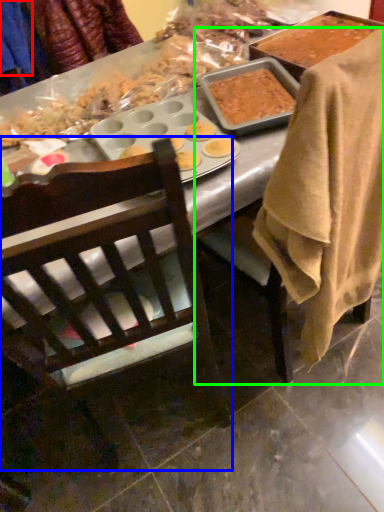
Question: Based on their relative distances, which object is nearer to clothing (highlighted by a red box)? Choose from chair (highlighted by a blue box) and chair (highlighted by a green box).

Choices:
 (A) chair
 (B) chair

Answer: (B)